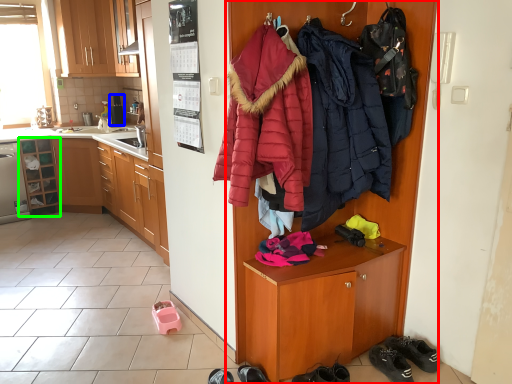
Question: Based on their relative distances, which object is farther from cupboard (highlighted by a red box)? Choose from appliance (highlighted by a blue box) and cabinetry (highlighted by a green box).

Choices:
 (A) appliance
 (B) cabinetry

Answer: (A)